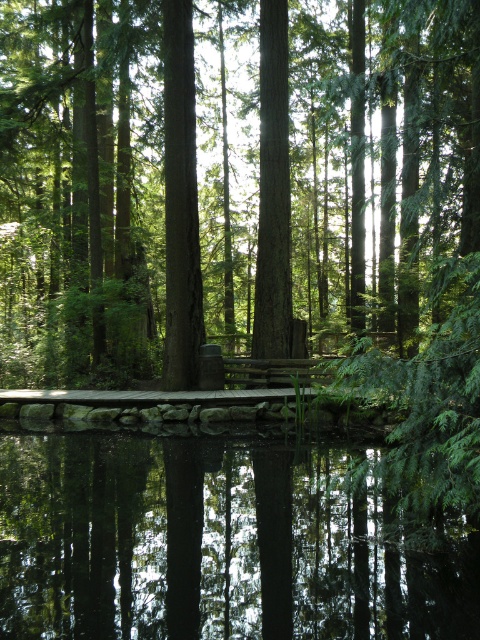
Question: Which of the following is the farthest from the observer?

Choices:
 (A) (415, 609)
 (B) (158, 35)

Answer: (B)

Question: Does green matte tree at center lie in front of transparent water at center?

Choices:
 (A) no
 (B) yes

Answer: (A)

Question: Is green matte tree at center to the right of transparent water at center from the viewer's perspective?

Choices:
 (A) yes
 (B) no

Answer: (B)

Question: Does green matte tree at center have a larger size compared to transparent water at center?

Choices:
 (A) no
 (B) yes

Answer: (B)